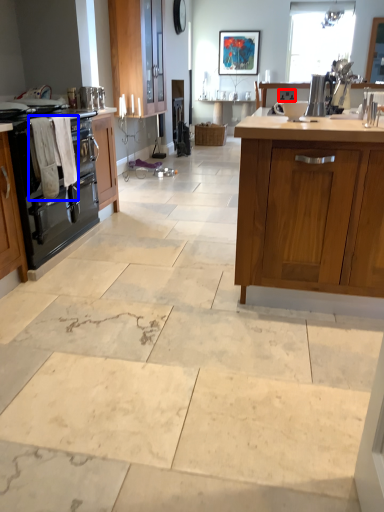
Question: Which object is further to the camera taking this photo, appliance (highlighted by a red box) or laundry (highlighted by a blue box)?

Choices:
 (A) appliance
 (B) laundry

Answer: (A)